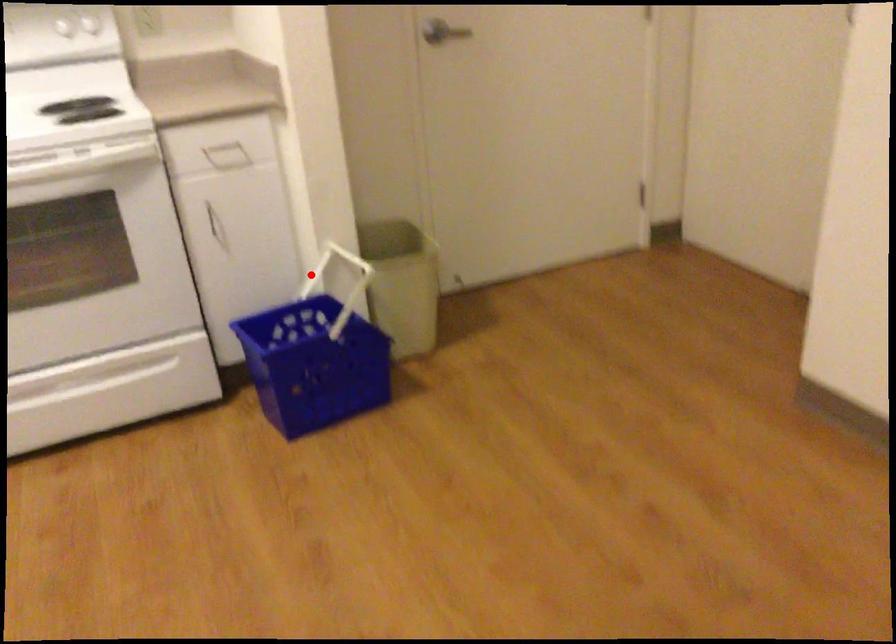
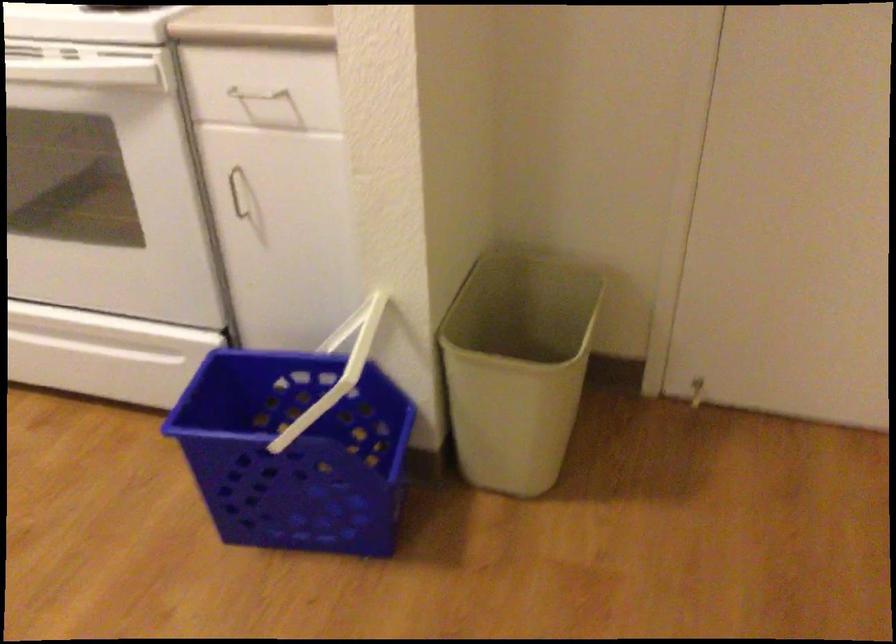
Question: I am providing you with two images of the same scene from different viewpoints. A red point is shown in image1. For the corresponding object point in image2, is it positioned nearer or farther from the camera?

Choices:
 (A) Nearer
 (B) Farther

Answer: (A)